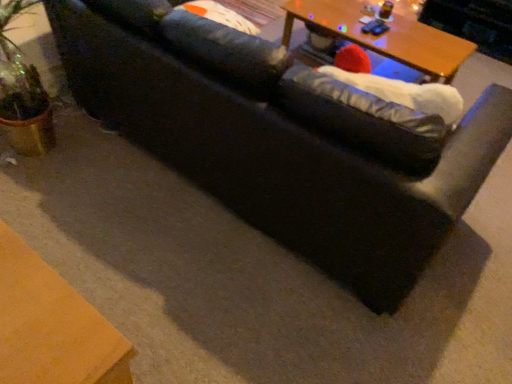
The image size is (512, 384). What do you see at coordinates (385, 36) in the screenshot? I see `wooden table at upper center` at bounding box center [385, 36].

Locate an element on the screen. The image size is (512, 384). wooden table at upper center is located at coordinates (385, 36).

What is the approximate width of white fabric bean bag at right?

It is 10.91 inches.

Where is `white fabric bean bag at right`? white fabric bean bag at right is located at coordinates (362, 120).

This screenshot has width=512, height=384. What do you see at coordinates (362, 120) in the screenshot?
I see `white fabric bean bag at right` at bounding box center [362, 120].

Where is `wooden table at upper center`? wooden table at upper center is located at coordinates (385, 36).

Considering the relative positions of wooden table at upper center and white fabric bean bag at right in the image provided, is wooden table at upper center to the right of white fabric bean bag at right from the viewer's perspective?

Correct, you'll find wooden table at upper center to the right of white fabric bean bag at right.

Who is more distant, wooden table at upper center or white fabric bean bag at right?

wooden table at upper center.

Considering the points (293, 2) and (306, 112), which point is in front, point (293, 2) or point (306, 112)?

Positioned in front is point (306, 112).

From the image's perspective, is wooden table at upper center under white fabric bean bag at right?

Actually, wooden table at upper center appears above white fabric bean bag at right in the image.

From a real-world perspective, is wooden table at upper center physically below white fabric bean bag at right?

Yes, from a real-world perspective, wooden table at upper center is beneath white fabric bean bag at right.

Is wooden table at upper center wider or thinner than white fabric bean bag at right?

In the image, wooden table at upper center appears to be wider than white fabric bean bag at right.

In terms of height, does wooden table at upper center look taller or shorter compared to white fabric bean bag at right?

In the image, wooden table at upper center appears to be taller than white fabric bean bag at right.

Considering the sizes of objects wooden table at upper center and white fabric bean bag at right in the image provided, who is smaller, wooden table at upper center or white fabric bean bag at right?

Smaller between the two is white fabric bean bag at right.

Is wooden table at upper center inside the boundaries of white fabric bean bag at right, or outside?

wooden table at upper center cannot be found inside white fabric bean bag at right.

Would you consider wooden table at upper center to be distant from white fabric bean bag at right?

Indeed, wooden table at upper center is not near white fabric bean bag at right.

Is wooden table at upper center facing away from white fabric bean bag at right?

No, wooden table at upper center's orientation is not away from white fabric bean bag at right.

How much distance is there between wooden table at upper center and white fabric bean bag at right?

4.27 feet.

What are the coordinates of `table to the right of white fabric bean bag at right` in the screenshot? It's located at (385, 36).

Can you confirm if white fabric bean bag at right is positioned to the left of wooden table at upper center?

Correct, you'll find white fabric bean bag at right to the left of wooden table at upper center.

In the image, is white fabric bean bag at right positioned in front of or behind wooden table at upper center?

In the image, white fabric bean bag at right appears in front of wooden table at upper center.

Which is farther from the camera, (312, 102) or (348, 27)?

The point (348, 27) is behind.

From the image's perspective, which object appears higher, white fabric bean bag at right or wooden table at upper center?

From the image's view, wooden table at upper center is above.

From a real-world perspective, is white fabric bean bag at right above or below wooden table at upper center?

white fabric bean bag at right is situated higher than wooden table at upper center in the real world.

Between white fabric bean bag at right and wooden table at upper center, which one has smaller width?

Thinner between the two is white fabric bean bag at right.

Considering the relative sizes of white fabric bean bag at right and wooden table at upper center in the image provided, is white fabric bean bag at right shorter than wooden table at upper center?

Yes.

Considering the relative sizes of white fabric bean bag at right and wooden table at upper center in the image provided, is white fabric bean bag at right smaller than wooden table at upper center?

Yes.

Is white fabric bean bag at right situated inside wooden table at upper center or outside?

white fabric bean bag at right is not inside wooden table at upper center, it's outside.

Looking at this image, are white fabric bean bag at right and wooden table at upper center located far from each other?

Absolutely, white fabric bean bag at right is distant from wooden table at upper center.

Is white fabric bean bag at right oriented towards wooden table at upper center?

No, white fabric bean bag at right is not turned towards wooden table at upper center.

Locate an element on the screen. The image size is (512, 384). table lying above the white fabric bean bag at right (from the image's perspective) is located at coordinates (385, 36).

Where is `table that appears on the right of white fabric bean bag at right`? The width and height of the screenshot is (512, 384). table that appears on the right of white fabric bean bag at right is located at coordinates (385, 36).

In order to click on bean bag chair in front of the wooden table at upper center in this screenshot , I will do `click(362, 120)`.